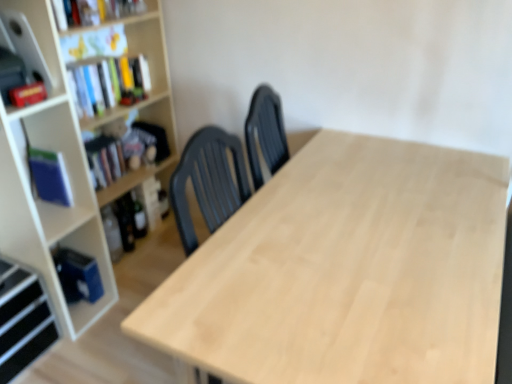
At what (x,y) coordinates should I click in order to perform the action: click on free space above light wood table at center (from a real-world perspective). Please return your answer as a coordinate pair (x, y). The width and height of the screenshot is (512, 384). Looking at the image, I should click on (376, 233).